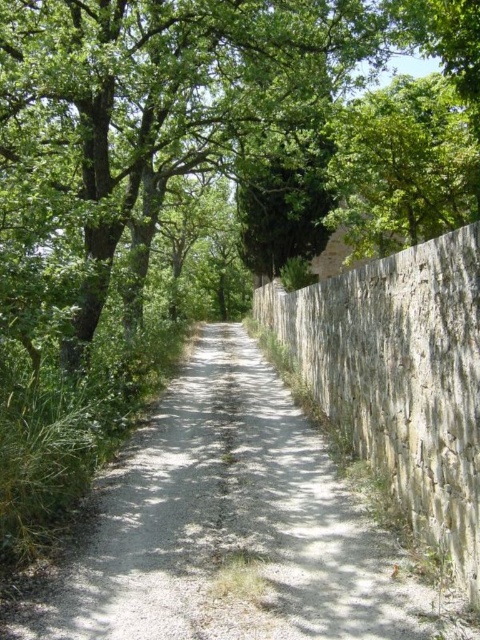
You are standing on the gray gravel path at center and want to walk towards the green leafy tree at center. Which direction should you move to reach it?

The green leafy tree at center is to the left of the gray gravel path at center, so you should move to your left to reach it.

You are standing on the gray gravel path at center and want to reach the green leafy tree at center. Can you walk straight ahead without any obstacles?

The green leafy tree at center is taller than the gray gravel path at center, so yes, you can walk straight ahead without any obstacles since the tree does not block the path.